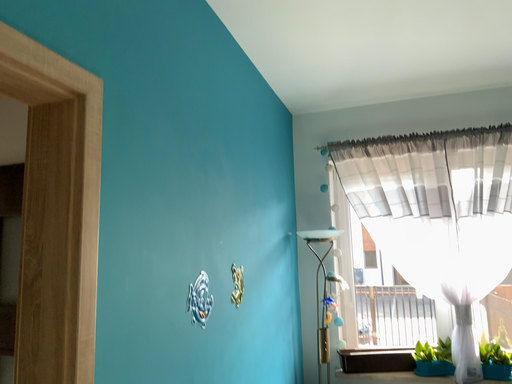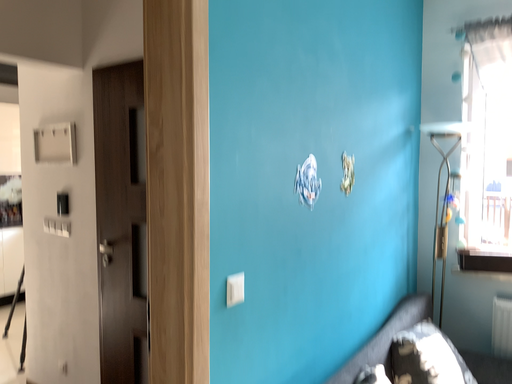
Question: Which way did the camera rotate in the video?

Choices:
 (A) rotated right
 (B) rotated left

Answer: (B)